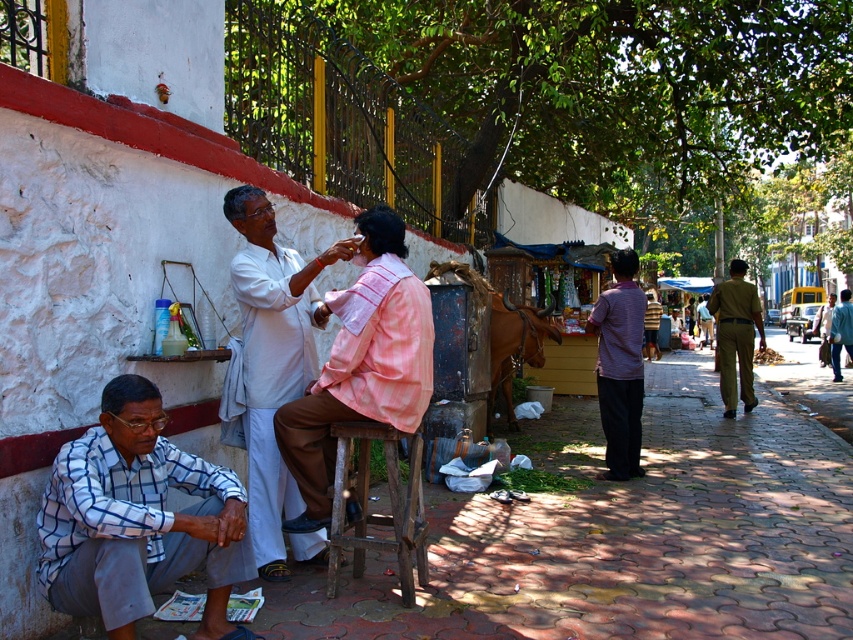
Question: Is white cotton kurta at center below blue shirt at center?

Choices:
 (A) yes
 (B) no

Answer: (A)

Question: Is purple cotton shirt at center to the left of blue shirt at center from the viewer's perspective?

Choices:
 (A) no
 (B) yes

Answer: (B)

Question: Which object is the farthest from the blue shirt at center?

Choices:
 (A) brick pavement at lower left
 (B) purple cotton shirt at center

Answer: (B)

Question: Which of these objects is positioned farthest from the dark green uniform at center?

Choices:
 (A) brick pavement at lower left
 (B) blue shirt at center

Answer: (B)

Question: Which of the following is the farthest from the observer?

Choices:
 (A) (642, 321)
 (B) (450, 605)
 (C) (239, 513)
 (D) (289, 509)

Answer: (A)

Question: Does white cotton kurta at center appear on the right side of dark green uniform at center?

Choices:
 (A) yes
 (B) no

Answer: (B)